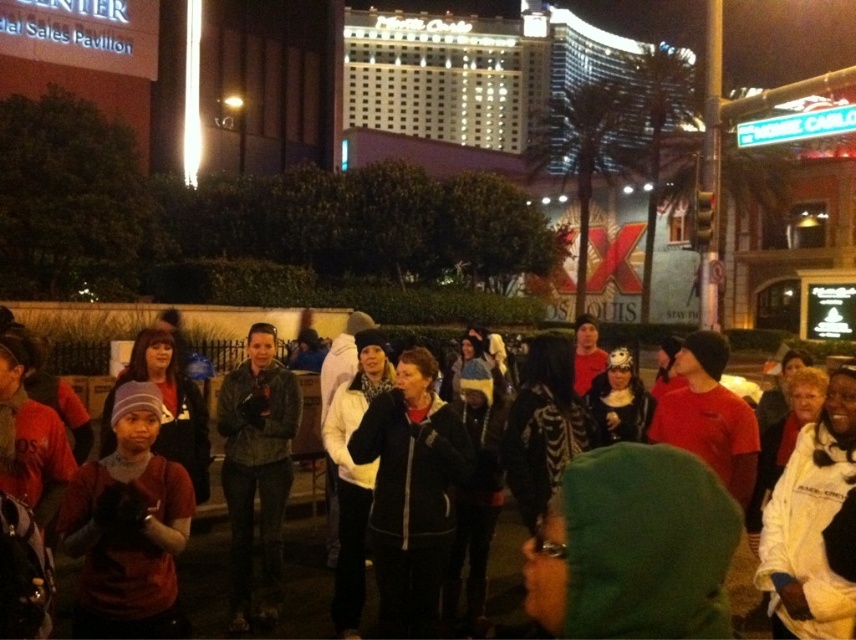
You are a photographer standing at the edge of the crowd. You want to take a photo that includes both the matte red shirt at center and the black fleece jacket at center. Given that your camera has a maximum focal length that allows capturing objects up to 8 meters apart in the same frame, will you be able to include both in the photo?

The matte red shirt at center and black fleece jacket at center are 8.48 meters apart, which exceeds the camera maximum focal length of 8 meters. Therefore, you cannot include both in the same photo.

You are a photographer trying to capture a candid shot of the leather jacket at center without including the matte red shirt at center in the frame. Is this possible given their positions?

The matte red shirt at center is positioned over the leather jacket at center, so it would block the view of the leather jacket at center. Therefore, capturing the leather jacket at center without the matte red shirt at center in the frame is not possible.